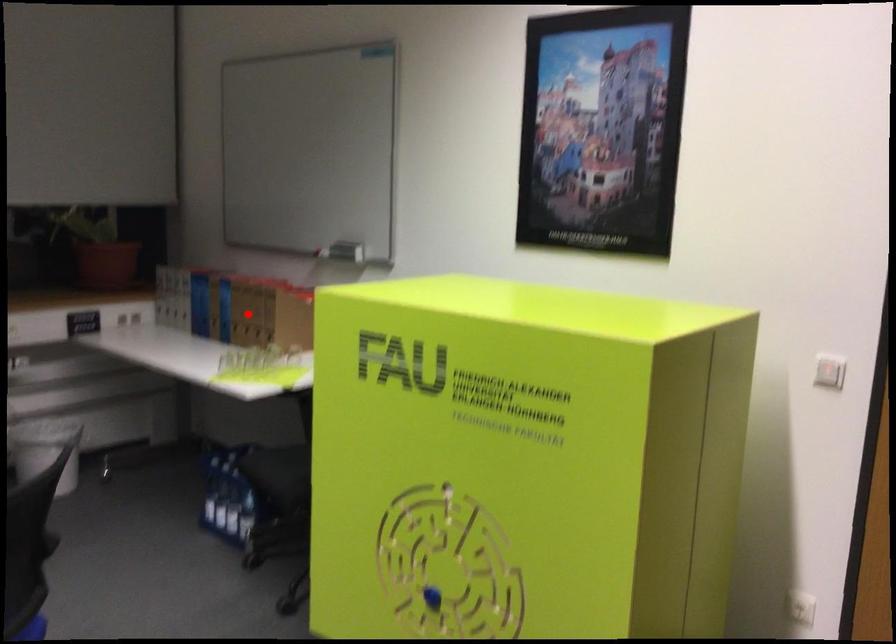
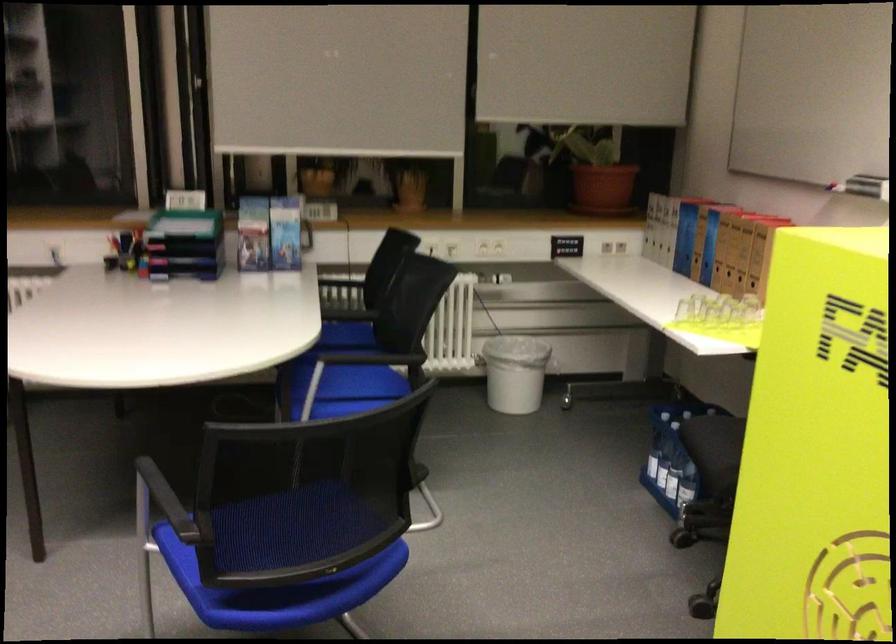
Question: I am providing you with two images of the same scene from different viewpoints. A red point is shown in image1. For the corresponding object point in image2, is it positioned nearer or farther from the camera?

Choices:
 (A) Nearer
 (B) Farther

Answer: (A)